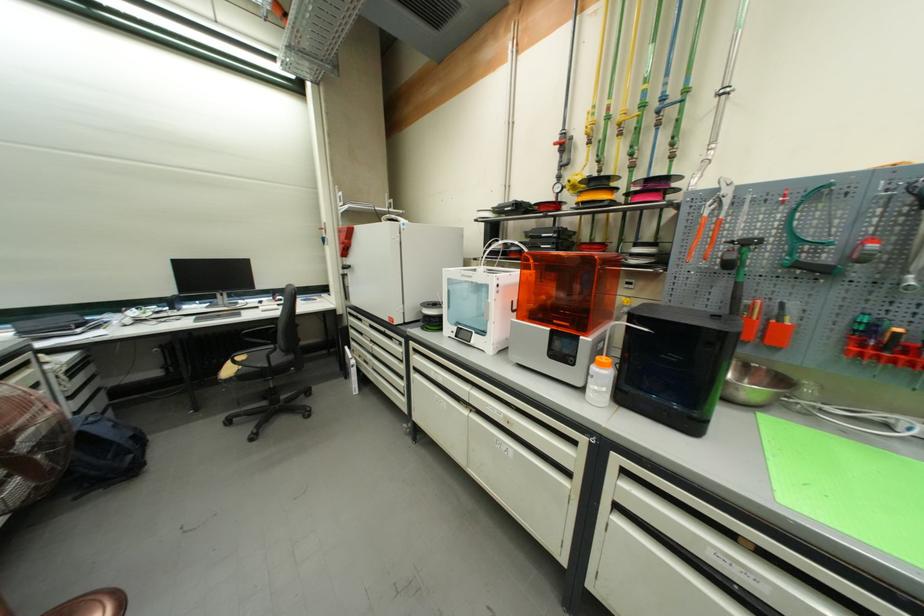
Where would you grip the orange handled pliers? Please return your answer as a coordinate pair (x, y).

(712, 217)